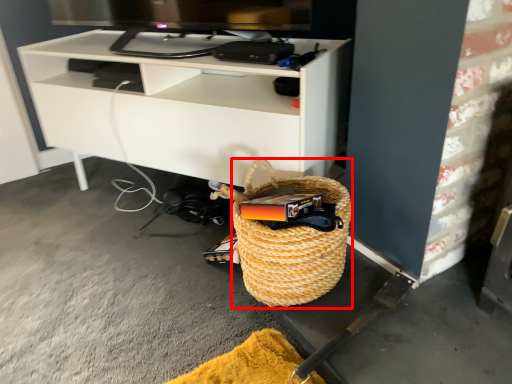
Question: From the image's perspective, what is the correct spatial positioning of basket (annotated by the red box) in reference to shelf?

Choices:
 (A) below
 (B) above

Answer: (A)